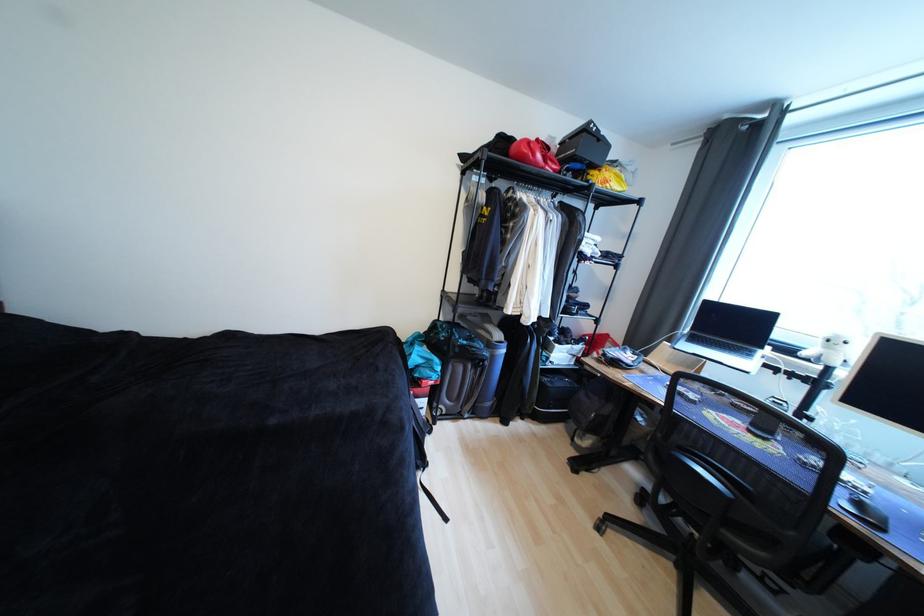
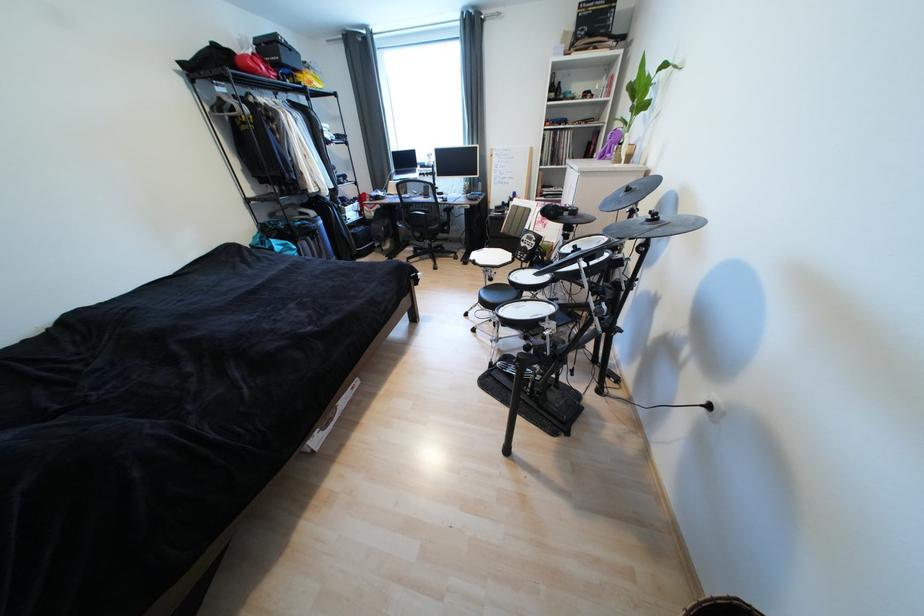
Where in the second image is the point corresponding to (x=589, y=161) from the first image?

(294, 68)